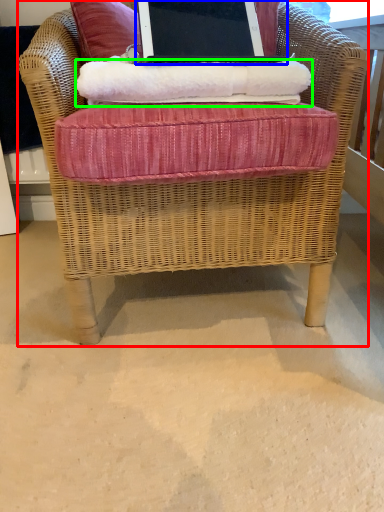
Question: Estimate the real-world distances between objects in this image. Which object is farther from chair (highlighted by a red box), laptop (highlighted by a blue box) or material (highlighted by a green box)?

Choices:
 (A) laptop
 (B) material

Answer: (A)